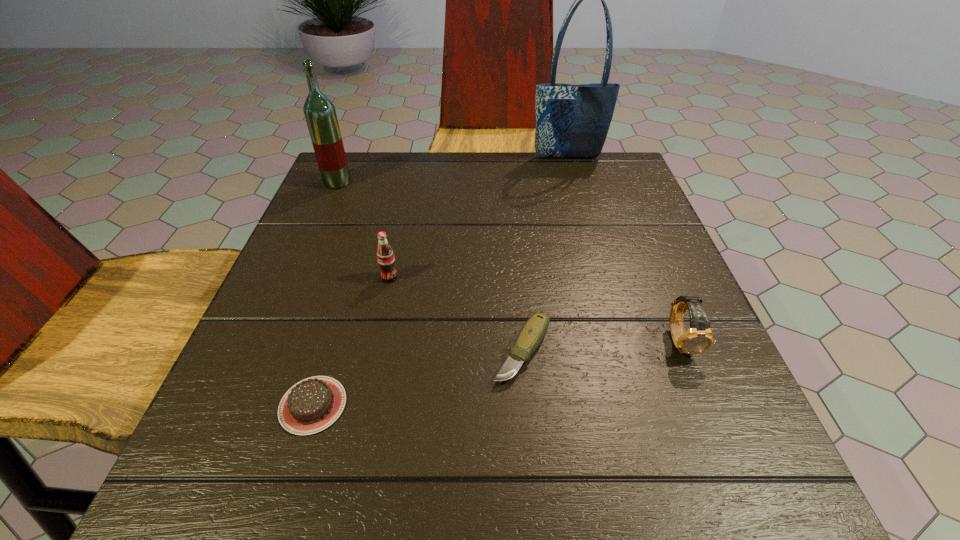
At what (x,y) coordinates should I click in order to perform the action: click on free region located 0.350m on the front of the fifth shortest object. Please return your answer as a coordinate pair (x, y). The width and height of the screenshot is (960, 540). Looking at the image, I should click on (290, 294).

Locate an element on the screen. The width and height of the screenshot is (960, 540). free spot located 0.300m on the back of the third object from left to right is located at coordinates (409, 187).

Identify the location of free space located on the face of the third shortest object. (718, 433).

The width and height of the screenshot is (960, 540). Find the location of `vacant space positioned 0.230m on the back of the pocketknife`. vacant space positioned 0.230m on the back of the pocketknife is located at coordinates (513, 237).

The width and height of the screenshot is (960, 540). What are the coordinates of `vacant region located 0.080m on the right of the fifth object from right to left` in the screenshot? It's located at (399, 405).

At what (x,y) coordinates should I click in order to perform the action: click on shopping bag present at the far edge. Please return your answer as a coordinate pair (x, y). The image size is (960, 540). Looking at the image, I should click on (572, 121).

Where is `liquor positioned at the far edge`? The height and width of the screenshot is (540, 960). liquor positioned at the far edge is located at coordinates (320, 114).

Locate an element on the screen. liquor that is positioned at the left edge is located at coordinates (320, 114).

Where is `chocolate cake that is at the left edge`? The image size is (960, 540). chocolate cake that is at the left edge is located at coordinates (313, 404).

Locate an element on the screen. This screenshot has height=540, width=960. shopping bag positioned at the right edge is located at coordinates (572, 121).